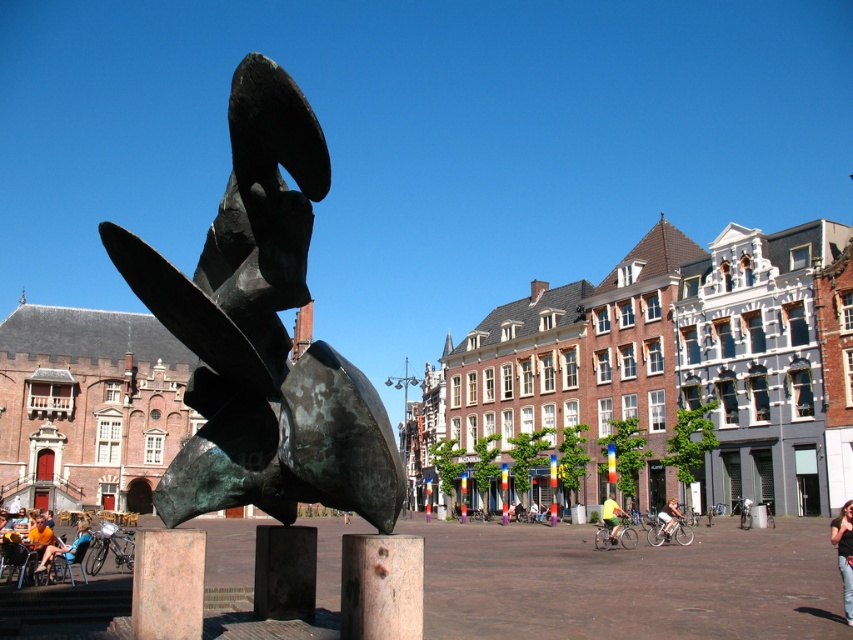
How much distance is there between denim pants at lower right and orange t-shirt at lower left?

denim pants at lower right and orange t-shirt at lower left are 45.12 meters apart from each other.

Is point (843, 563) less distant than point (41, 536)?

Yes, point (843, 563) is in front of point (41, 536).

Identify the location of denim pants at lower right. (844, 554).

Which is above, denim pants at lower right or yellow fabric cyclist at center?

denim pants at lower right is higher up.

Measure the distance from denim pants at lower right to yellow fabric cyclist at center.

They are 18.79 meters apart.

Locate an element on the screen. The image size is (853, 640). denim pants at lower right is located at coordinates (844, 554).

Does bronze abstract sculpture at center appear on the right side of orange t-shirt at lower left?

Yes, bronze abstract sculpture at center is to the right of orange t-shirt at lower left.

Who is positioned more to the right, bronze abstract sculpture at center or orange t-shirt at lower left?

Positioned to the right is bronze abstract sculpture at center.

Is point (397, 467) less distant than point (50, 544)?

Yes, point (397, 467) is in front of point (50, 544).

The height and width of the screenshot is (640, 853). What are the coordinates of `bronze abstract sculpture at center` in the screenshot? It's located at tap(263, 333).